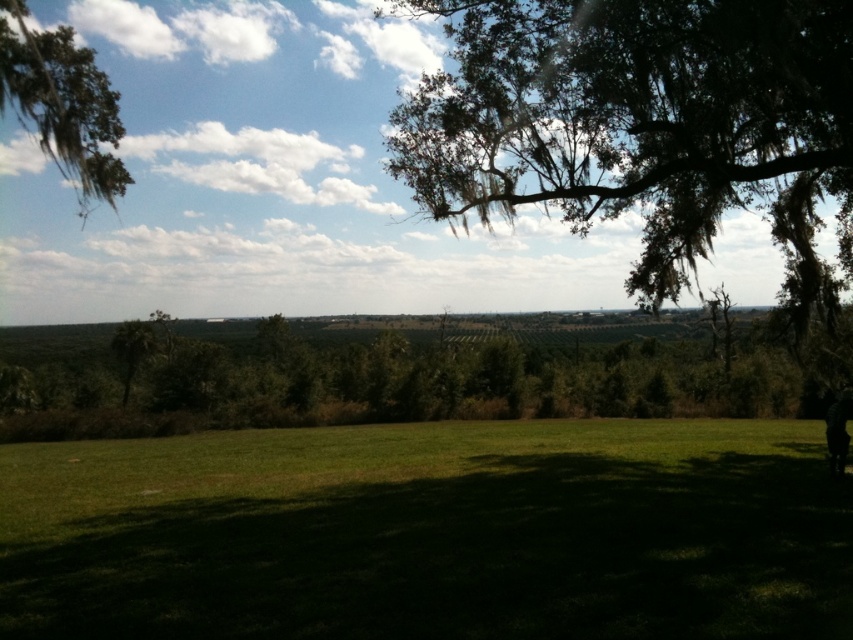
Question: Observing the image, what is the correct spatial positioning of green grass at lower center in reference to dark green fabric at lower right?

Choices:
 (A) above
 (B) below

Answer: (B)

Question: Which of the following is the farthest from the observer?

Choices:
 (A) dark green fabric at lower right
 (B) green leafy tree at center
 (C) green mossy tree at upper right
 (D) green grass at lower center

Answer: (B)

Question: Which point is closer to the camera?

Choices:
 (A) (73, 60)
 (B) (741, 204)

Answer: (A)

Question: Among these objects, which one is farthest from the camera?

Choices:
 (A) green mossy branch at upper left
 (B) dark green fabric at lower right
 (C) green mossy tree at upper right
 (D) green leafy tree at center

Answer: (D)

Question: Is green mossy tree at upper right below dark green fabric at lower right?

Choices:
 (A) yes
 (B) no

Answer: (B)

Question: Where is green mossy tree at upper right located in relation to dark green fabric at lower right in the image?

Choices:
 (A) right
 (B) left

Answer: (B)